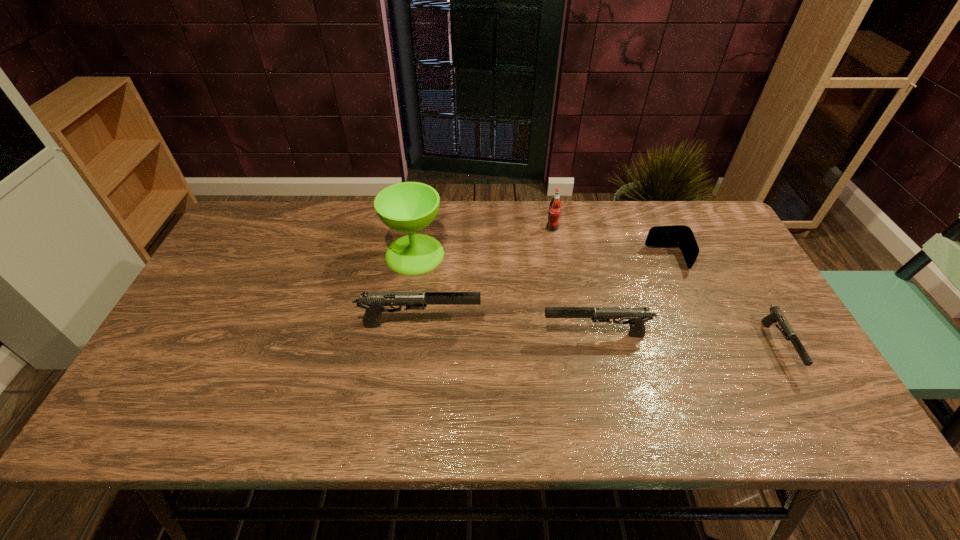
The width and height of the screenshot is (960, 540). Identify the location of blank space located 0.170m at the muzzle end of the leftmost gun. (546, 324).

The image size is (960, 540). I want to click on free spot located 0.320m at the muzzle end of the second gun from right to left, so click(416, 335).

The image size is (960, 540). I want to click on free spot located 0.390m at the muzzle end of the second gun from right to left, so click(388, 335).

At what (x,y) coordinates should I click in order to perform the action: click on vacant space located 0.080m at the muzzle end of the second gun from right to left. Please return your answer as a coordinate pair (x, y). The image size is (960, 540). Looking at the image, I should click on (511, 335).

Where is `free space located on the label of the soda bottle`? free space located on the label of the soda bottle is located at coordinates (566, 310).

Identify the location of vacant area situated 0.160m on the outer surface of the wallet. This screenshot has width=960, height=540. point(594,258).

Where is `free spot located on the outer surface of the wallet`? This screenshot has height=540, width=960. free spot located on the outer surface of the wallet is located at coordinates (588, 258).

Where is `vacant point located 0.080m on the outer surface of the wallet`? This screenshot has height=540, width=960. vacant point located 0.080m on the outer surface of the wallet is located at coordinates (621, 258).

Image resolution: width=960 pixels, height=540 pixels. Identify the location of free spot located on the right of the wineglass. (493, 254).

Find the location of a particular element. soda bottle present at the far edge is located at coordinates (x=555, y=206).